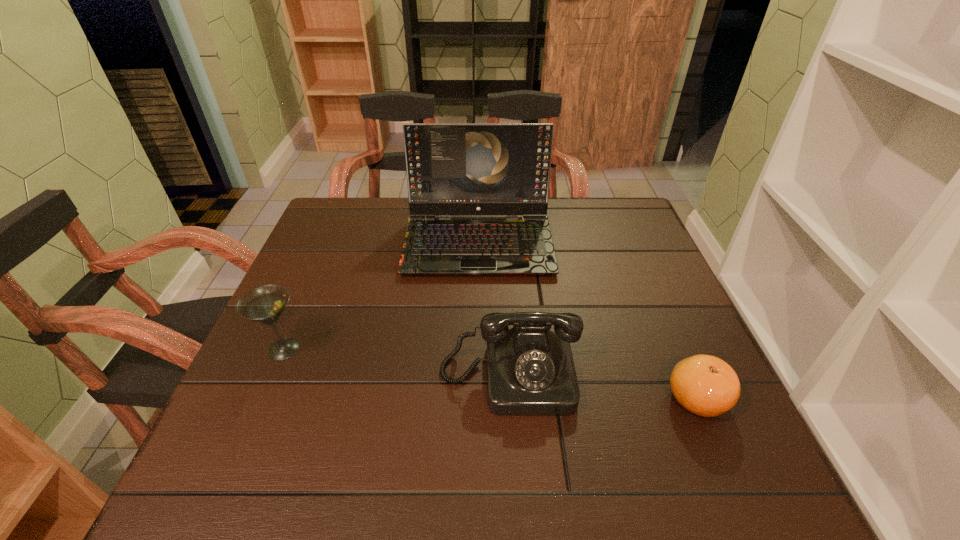
This screenshot has width=960, height=540. I want to click on laptop computer, so click(x=452, y=168).

The image size is (960, 540). Find the location of `the tallest object`. the tallest object is located at coordinates (452, 168).

The image size is (960, 540). Find the location of `the leftmost object`. the leftmost object is located at coordinates (265, 304).

The image size is (960, 540). Find the location of `martini`. martini is located at coordinates (265, 304).

At what (x,y) coordinates should I click in order to perform the action: click on the second shortest object. Please return your answer as a coordinate pair (x, y). Looking at the image, I should click on (530, 370).

Where is `clementine`? The width and height of the screenshot is (960, 540). clementine is located at coordinates (705, 385).

The width and height of the screenshot is (960, 540). In order to click on the rightmost object in this screenshot , I will do `click(705, 385)`.

This screenshot has height=540, width=960. I want to click on vacant space located 0.150m on the screen of the laptop computer, so click(x=478, y=322).

This screenshot has width=960, height=540. What are the coordinates of `vacant space located 0.260m on the front of the leftmost object` in the screenshot? It's located at (220, 498).

Identify the location of vacant space located 0.150m on the dial of the third tallest object. This screenshot has height=540, width=960. (517, 499).